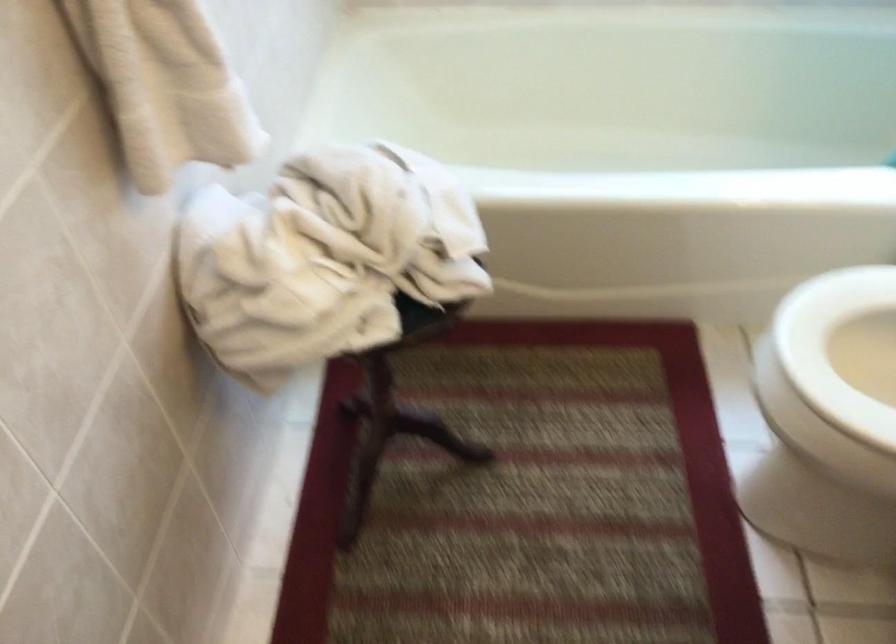
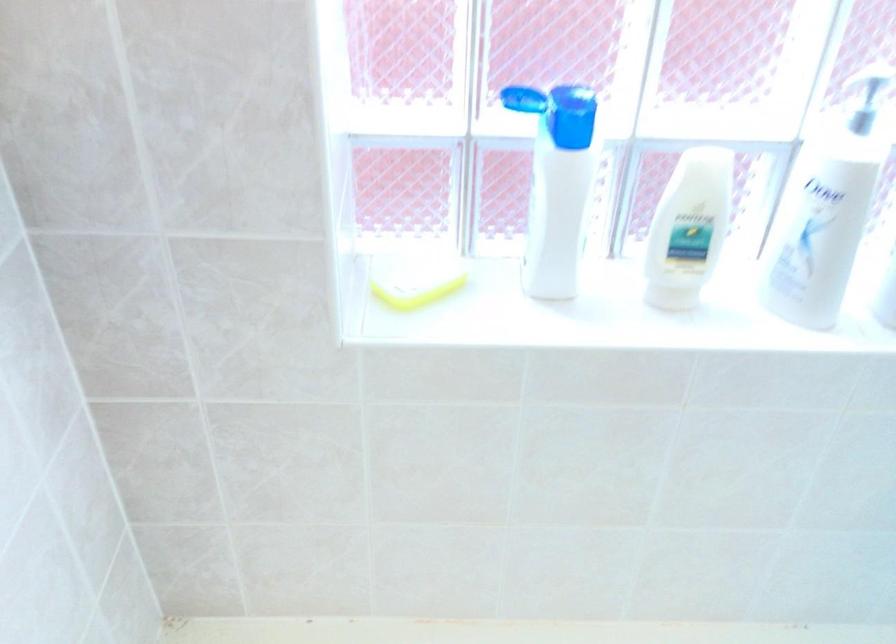
Question: The images are taken continuously from a first-person perspective. In which direction are you moving?

Choices:
 (A) Left
 (B) Right
 (C) Forward
 (D) Backward

Answer: (C)